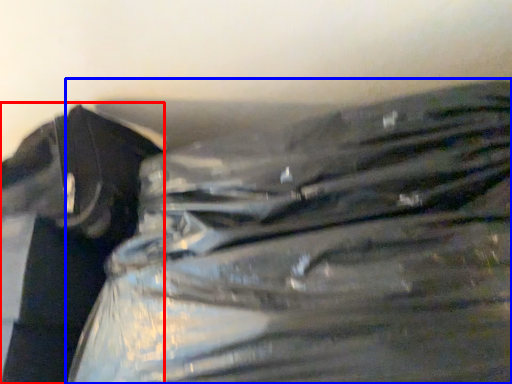
Question: Which of the following is the closest to the observer, waste (highlighted by a red box) or plastic bag (highlighted by a blue box)?

Choices:
 (A) waste
 (B) plastic bag

Answer: (B)